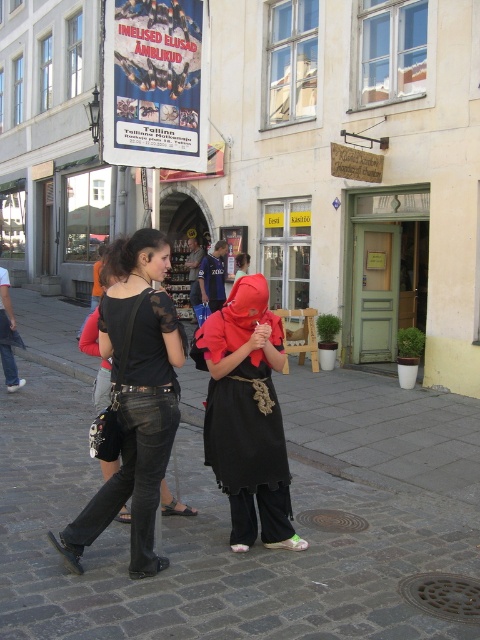
Is cobblestone pavement at center above black leather pants at lower left?

Actually, cobblestone pavement at center is below black leather pants at lower left.

Does cobblestone pavement at center have a larger size compared to black leather pants at lower left?

Correct, cobblestone pavement at center is larger in size than black leather pants at lower left.

This screenshot has height=640, width=480. In order to click on cobblestone pavement at center in this screenshot , I will do `click(228, 508)`.

Who is more forward, (48, 356) or (182, 86)?

Point (182, 86) is more forward.

Find the location of a particular element. cobblestone pavement at center is located at coordinates (228, 508).

Can you confirm if cobblestone pavement at center is wider than matte black dress at center?

Indeed, cobblestone pavement at center has a greater width compared to matte black dress at center.

Does cobblestone pavement at center have a lesser height compared to matte black dress at center?

No.

Who is more distant from viewer, [168,548] or [242,256]?

The point [242,256] is more distant.

What are the coordinates of `cobblestone pavement at center` in the screenshot? It's located at (228, 508).